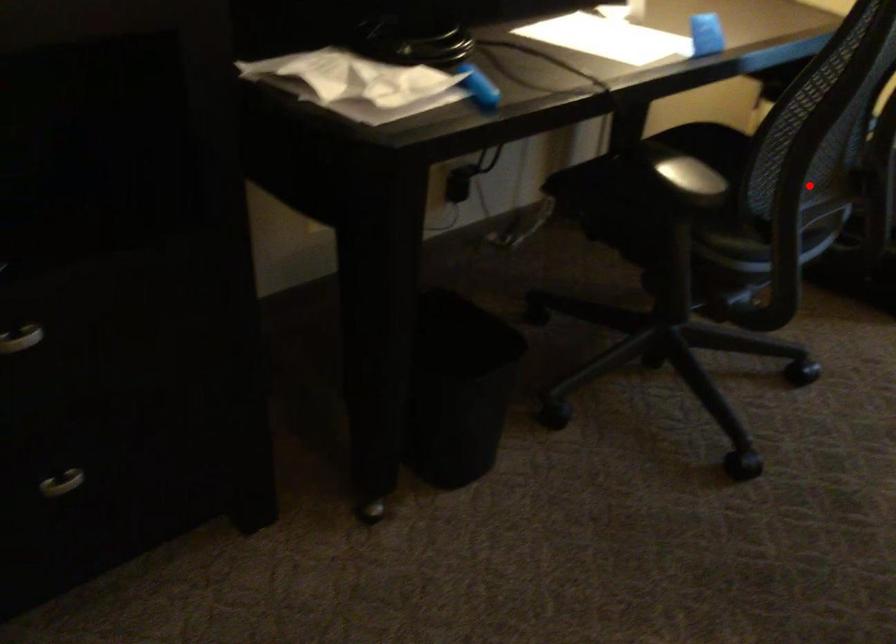
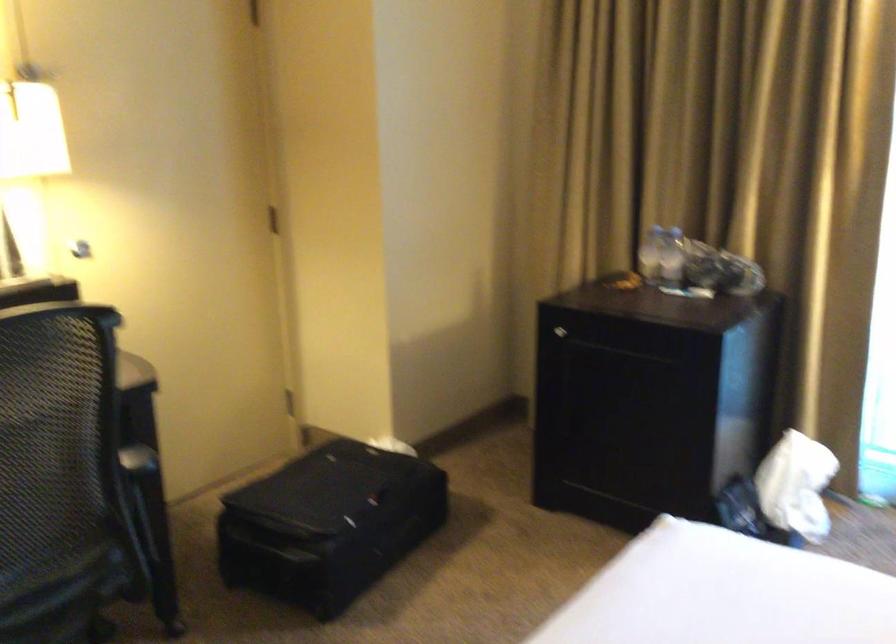
Question: I am providing you with two images of the same scene from different viewpoints. A red point is shown in image1. For the corresponding object point in image2, is it positioned nearer or farther from the camera?

Choices:
 (A) Nearer
 (B) Farther

Answer: (B)